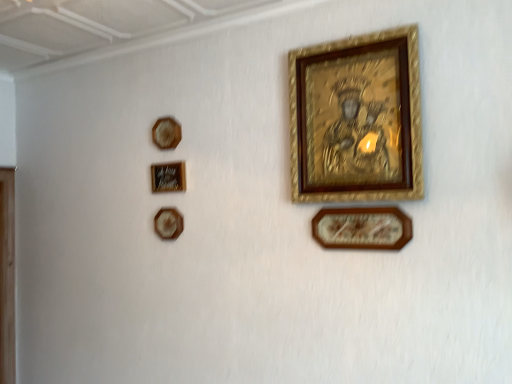
Question: Considering the relative positions of wooden picture frame at lower center, which is counted as the fifth picture frame, starting from the left, and matte brown picture frame at upper left, the fourth picture frame when ordered from right to left, in the image provided, is wooden picture frame at lower center, which is counted as the fifth picture frame, starting from the left, in front of matte brown picture frame at upper left, the fourth picture frame when ordered from right to left,?

Choices:
 (A) yes
 (B) no

Answer: (A)

Question: Does wooden picture frame at lower center, placed as the first picture frame when sorted from right to left, have a smaller size compared to matte brown picture frame at upper left, acting as the 2th picture frame starting from the left?

Choices:
 (A) yes
 (B) no

Answer: (B)

Question: Is wooden picture frame at lower center, which is counted as the fifth picture frame, starting from the left, taller than matte brown picture frame at upper left, the fourth picture frame when ordered from right to left?

Choices:
 (A) yes
 (B) no

Answer: (A)

Question: From a real-world perspective, is wooden picture frame at lower center, placed as the first picture frame when sorted from right to left, physically above matte brown picture frame at upper left, acting as the 2th picture frame starting from the left?

Choices:
 (A) yes
 (B) no

Answer: (B)

Question: Is wooden picture frame at lower center, which is counted as the fifth picture frame, starting from the left, completely or partially outside of matte brown picture frame at upper left, the fourth picture frame when ordered from right to left?

Choices:
 (A) yes
 (B) no

Answer: (A)

Question: Is wooden picture frame at lower center, which is counted as the fifth picture frame, starting from the left, wider than matte brown picture frame at upper left, acting as the 2th picture frame starting from the left?

Choices:
 (A) no
 (B) yes

Answer: (B)

Question: Considering the relative sizes of gold textured picture frame at upper center, positioned as the second picture frame in right-to-left order, and matte brown picture frame at upper left, acting as the 2th picture frame starting from the left, in the image provided, is gold textured picture frame at upper center, positioned as the second picture frame in right-to-left order, taller than matte brown picture frame at upper left, acting as the 2th picture frame starting from the left,?

Choices:
 (A) no
 (B) yes

Answer: (B)

Question: Is the position of gold textured picture frame at upper center, which ranks as the 4th picture frame in left-to-right order, less distant than that of matte brown picture frame at upper left, acting as the 2th picture frame starting from the left?

Choices:
 (A) yes
 (B) no

Answer: (A)

Question: Is gold textured picture frame at upper center, which ranks as the 4th picture frame in left-to-right order, outside of matte brown picture frame at upper left, acting as the 2th picture frame starting from the left?

Choices:
 (A) no
 (B) yes

Answer: (B)

Question: Is gold textured picture frame at upper center, positioned as the second picture frame in right-to-left order, positioned with its back to matte brown picture frame at upper left, acting as the 2th picture frame starting from the left?

Choices:
 (A) no
 (B) yes

Answer: (A)

Question: From a real-world perspective, is gold textured picture frame at upper center, positioned as the second picture frame in right-to-left order, positioned over matte brown picture frame at upper left, acting as the 2th picture frame starting from the left, based on gravity?

Choices:
 (A) no
 (B) yes

Answer: (B)

Question: From the image's perspective, is gold textured picture frame at upper center, which ranks as the 4th picture frame in left-to-right order, above matte brown picture frame at upper left, acting as the 2th picture frame starting from the left?

Choices:
 (A) no
 (B) yes

Answer: (B)

Question: Considering the relative sizes of matte brown picture frame at upper left, acting as the 2th picture frame starting from the left, and matte black picture frame at upper left, the 3th picture frame in the right-to-left sequence, in the image provided, is matte brown picture frame at upper left, acting as the 2th picture frame starting from the left, thinner than matte black picture frame at upper left, the 3th picture frame in the right-to-left sequence,?

Choices:
 (A) yes
 (B) no

Answer: (B)